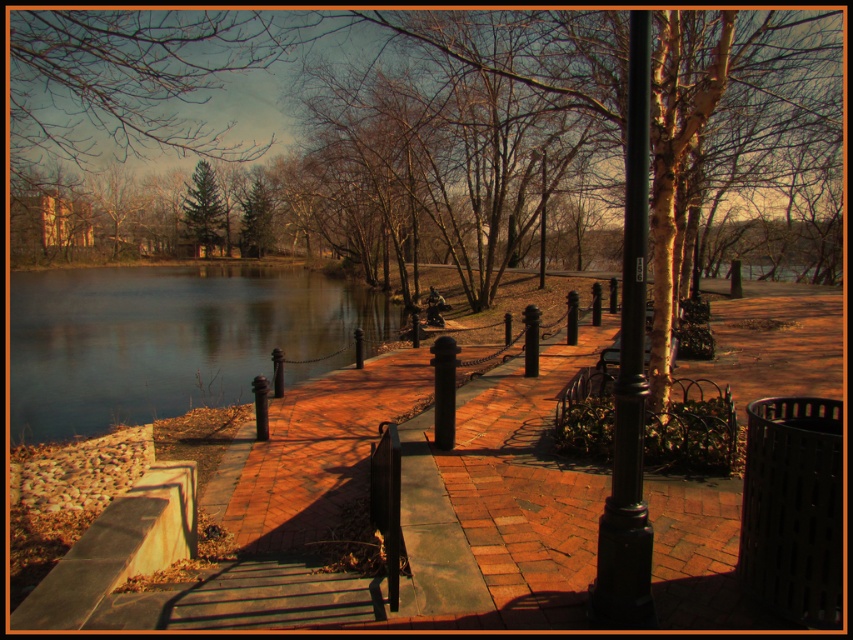
Between point (236, 305) and point (543, 204), which one is positioned behind?

Positioned behind is point (236, 305).

Does smooth water at center appear over metallic pole at center?

No, smooth water at center is not above metallic pole at center.

What do you see at coordinates (169, 339) in the screenshot? I see `smooth water at center` at bounding box center [169, 339].

Locate an element on the screen. The image size is (853, 640). smooth water at center is located at coordinates (169, 339).

Does point (227, 225) come closer to viewer compared to point (544, 204)?

No, it is not.

I want to click on green textured pine tree at upper center, so click(204, 208).

Measure the distance between green textured pine tree at upper center and green matte tree at center.

green textured pine tree at upper center and green matte tree at center are 4.40 meters apart.

Describe the element at coordinates (204, 208) in the screenshot. This screenshot has width=853, height=640. I see `green textured pine tree at upper center` at that location.

Does point (212, 195) come in front of point (262, 253)?

No, (212, 195) is behind (262, 253).

Image resolution: width=853 pixels, height=640 pixels. Identify the location of green textured pine tree at upper center. (204, 208).